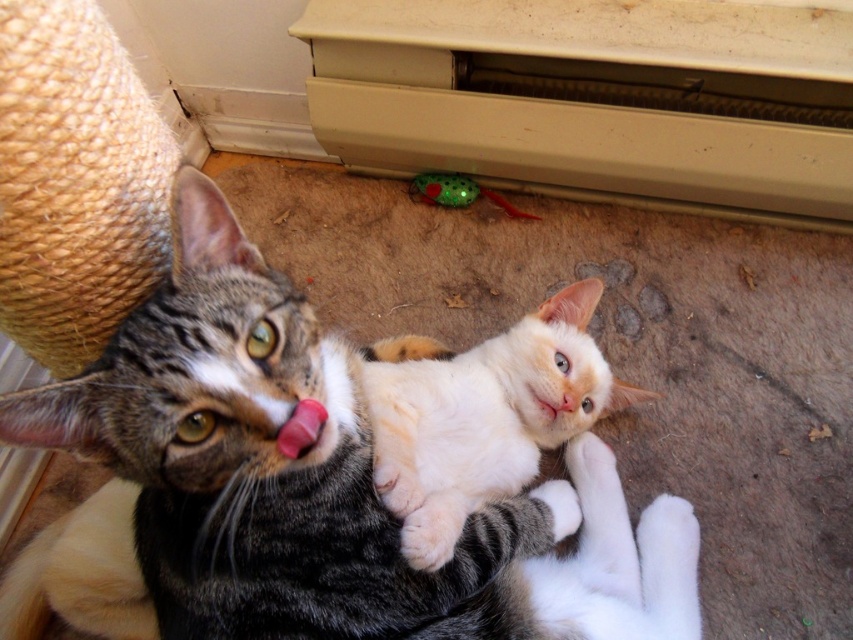
You are a photographer trying to capture a closeup shot of the pink glossy tongue at center. You notice the tabby fur cat at center is blocking part of the tongue. Can you adjust your position to see the tongue without moving the cats?

The tabby fur cat at center is located below the pink glossy tongue at center, so you can move your camera position slightly above the cats to capture the pink glossy tongue at center without obstruction from the tabby fur cat at center.

Looking at the scene with the two cats, can you tell me which object is positioned to the left of the other between the pink glossy tongue at center and the white matte mouth at center?

The pink glossy tongue at center is positioned to the left of the white matte mouth at center.